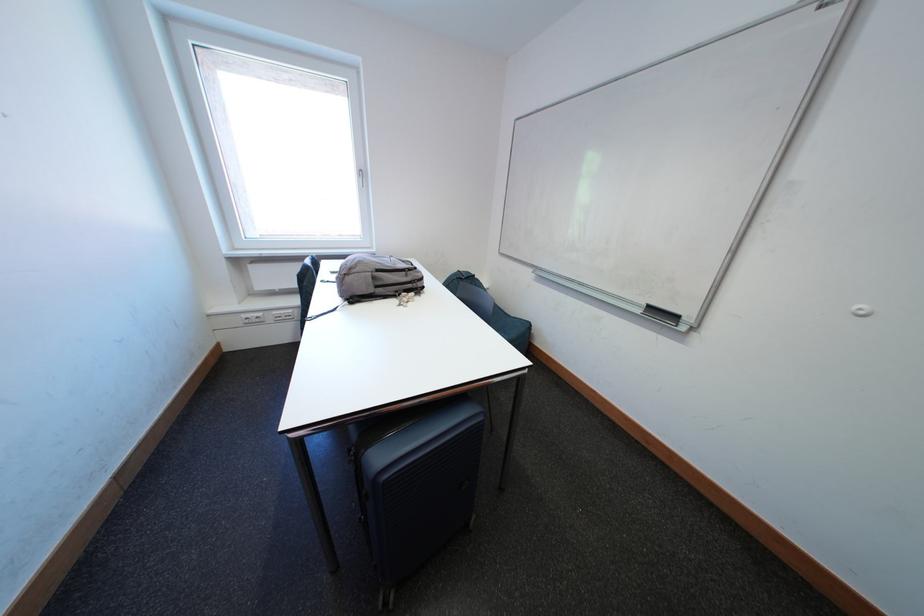
Where is `white window handle`? Image resolution: width=924 pixels, height=616 pixels. white window handle is located at coordinates (360, 177).